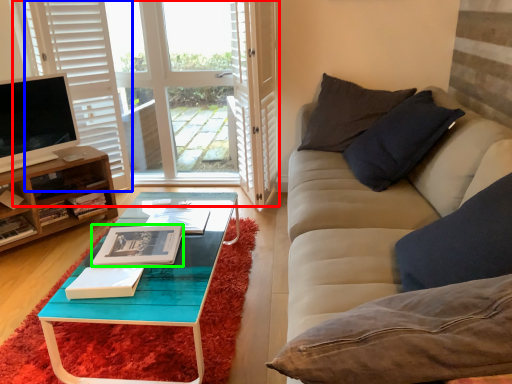
Question: Estimate the real-world distances between objects in this image. Which object is farther from window (highlighted by a red box), curtain (highlighted by a blue box) or book (highlighted by a green box)?

Choices:
 (A) curtain
 (B) book

Answer: (B)